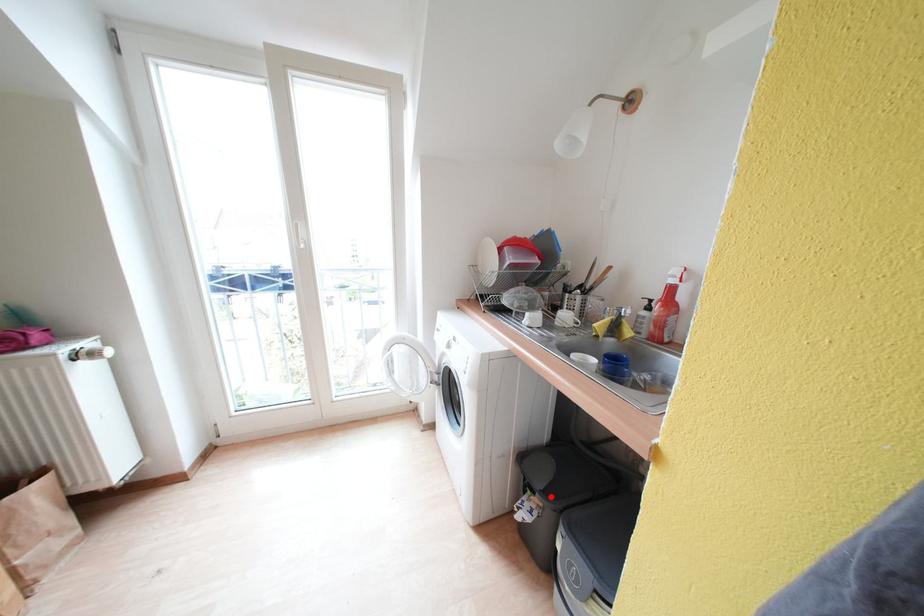
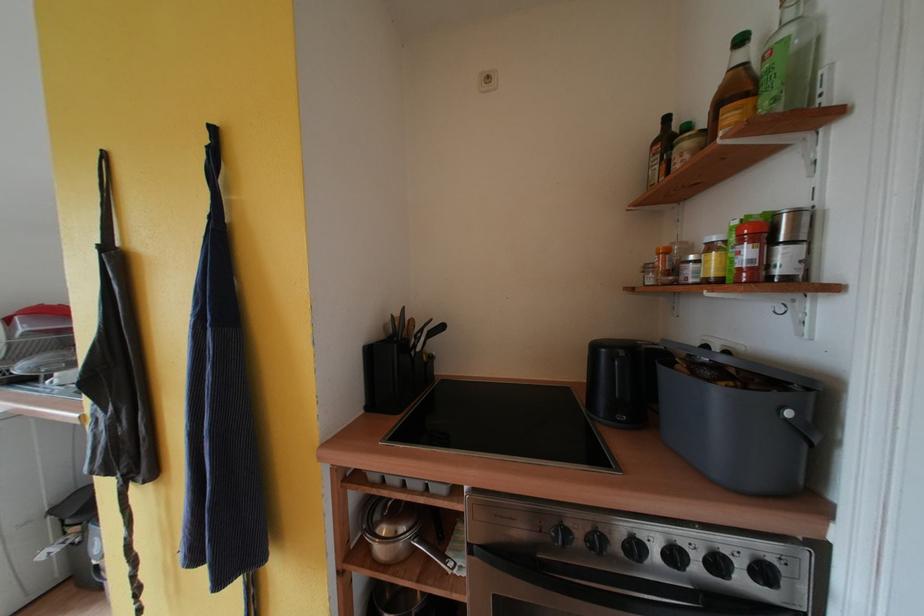
Question: I am providing you with two images of the same scene from different viewpoints. Given a red point in image1, look at the same physical point in image2. Is it:

Choices:
 (A) Closer to the viewpoint
 (B) Farther from the viewpoint

Answer: (A)